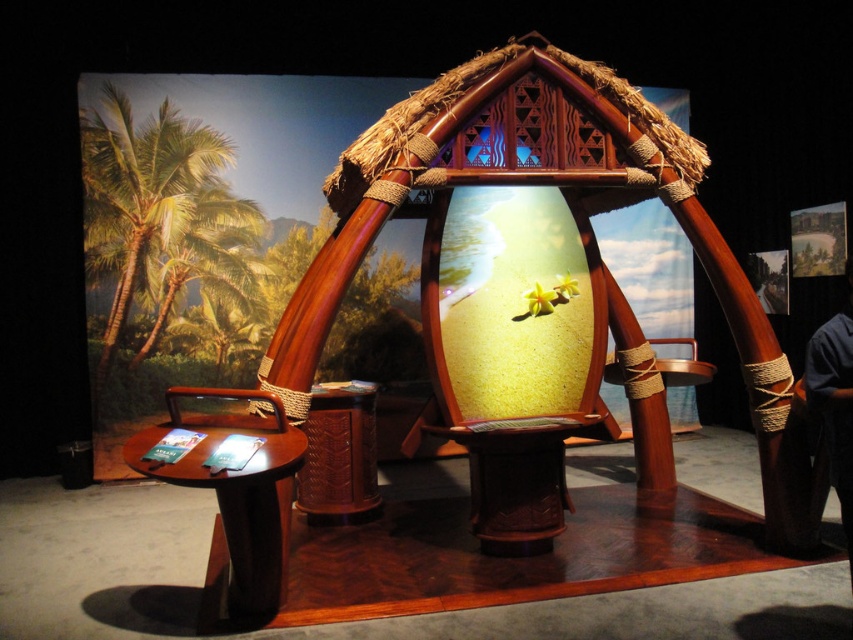
You are a photographer setting up for an event. You see the green leafy palm tree at left and the dark blue shirt at right in your camera frame. Which object is higher in the image?

The green leafy palm tree at left is higher than the dark blue shirt at right in the image.

You are standing in front of the decorative Polynesian archway and notice a point marked at coordinates (x=160, y=221). Based on the scene description, can you identify which object this point is located on?

The point at coordinates (x=160, y=221) is located on the green leafy palm tree at left.